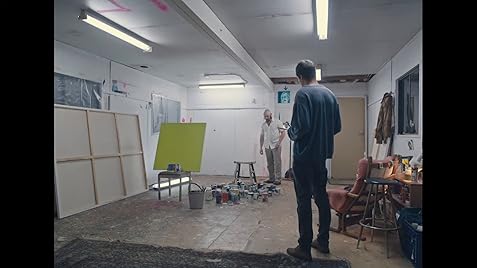
Identify the location of bucket. (194, 196).